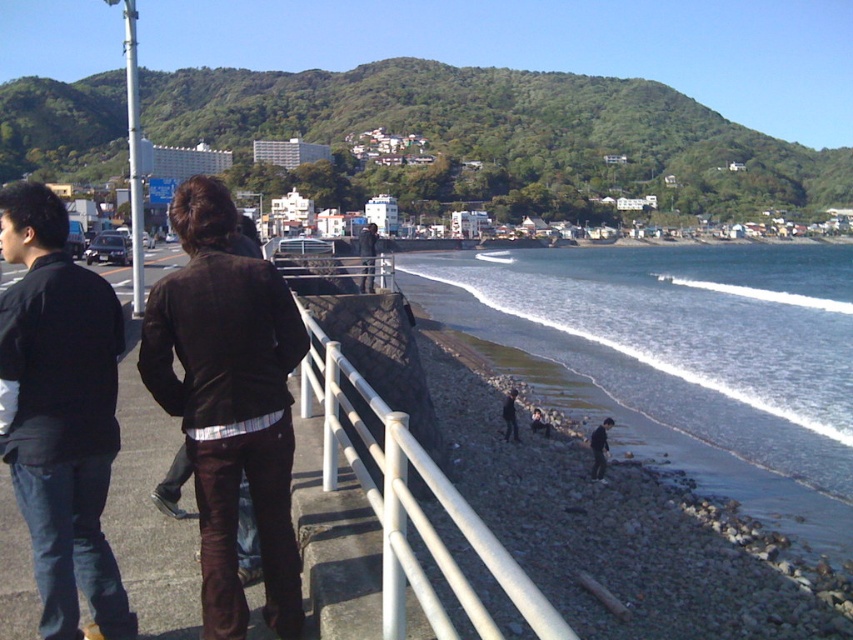
How much distance is there between dark brown leather jacket at left and dark brown leather jacket at center?

25.78 meters

Between point (3, 419) and point (368, 241), which one is positioned behind?

The point (368, 241) is behind.

This screenshot has width=853, height=640. Identify the location of dark brown leather jacket at left. (61, 412).

In the scene shown: Is clear water at beach right shorter than dark brown leather jacket at left?

No.

Can you confirm if clear water at beach right is positioned to the left of dark brown leather jacket at left?

In fact, clear water at beach right is to the right of dark brown leather jacket at left.

Does point (560, 266) lie behind point (51, 499)?

Yes, it is behind point (51, 499).

Identify the location of clear water at beach right. Image resolution: width=853 pixels, height=640 pixels. (682, 337).

Is point (660, 403) positioned after point (97, 387)?

Yes, it is.

Is the position of clear water at beach right more distant than that of black matte jacket at left?

Yes, it is.

Identify the location of clear water at beach right. (682, 337).

The image size is (853, 640). Find the location of `clear water at beach right`. clear water at beach right is located at coordinates (682, 337).